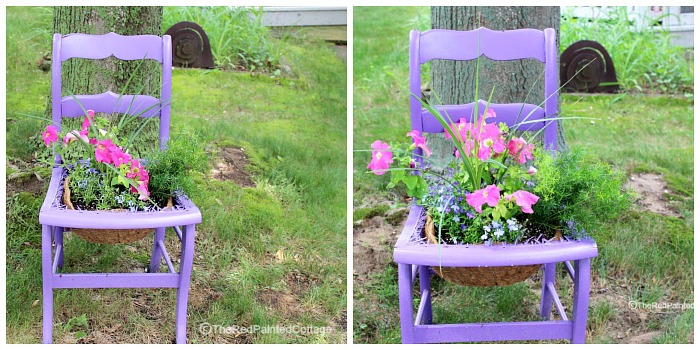
I want to click on purple chair, so click(188, 207), click(414, 247).